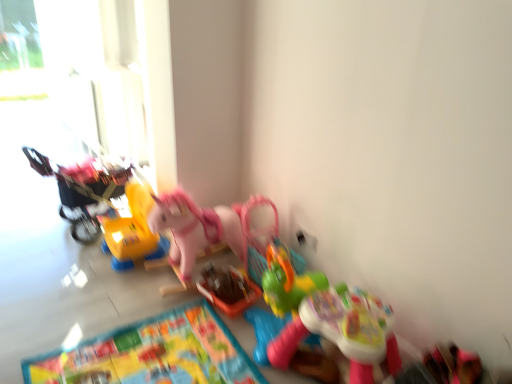
Question: Is multicolored fabric mat at lower center in front of yellow plastic toy at center-left, which is the 2th toy from left to right?

Choices:
 (A) no
 (B) yes

Answer: (B)

Question: Are multicolored fabric mat at lower center and yellow plastic toy at center-left, which ranks as the 5th toy in right-to-left order, making contact?

Choices:
 (A) no
 (B) yes

Answer: (A)

Question: From the image's perspective, would you say multicolored fabric mat at lower center is shown under yellow plastic toy at center-left, which is the 2th toy from left to right?

Choices:
 (A) yes
 (B) no

Answer: (A)

Question: Is multicolored fabric mat at lower center wider than yellow plastic toy at center-left, which ranks as the 5th toy in right-to-left order?

Choices:
 (A) no
 (B) yes

Answer: (B)

Question: Does multicolored fabric mat at lower center have a greater height compared to yellow plastic toy at center-left, which ranks as the 5th toy in right-to-left order?

Choices:
 (A) no
 (B) yes

Answer: (A)

Question: Could yellow plastic toy at center-left, which is the 2th toy from left to right, be considered to be inside multicolored fabric mat at lower center?

Choices:
 (A) yes
 (B) no

Answer: (B)

Question: Does pink plastic rocking horse at center, the 3th toy when ordered from left to right, come in front of pink plastic rocking horse at center, the third toy in the right-to-left sequence?

Choices:
 (A) no
 (B) yes

Answer: (B)

Question: From the image's perspective, is pink plastic rocking horse at center, positioned as the fourth toy in right-to-left order, beneath pink plastic rocking horse at center, the third toy in the right-to-left sequence?

Choices:
 (A) no
 (B) yes

Answer: (B)

Question: Is pink plastic rocking horse at center, the 3th toy when ordered from left to right, outside pink plastic rocking horse at center, the 4th toy in the left-to-right sequence?

Choices:
 (A) yes
 (B) no

Answer: (A)

Question: Does pink plastic rocking horse at center, positioned as the fourth toy in right-to-left order, have a larger size compared to pink plastic rocking horse at center, the third toy in the right-to-left sequence?

Choices:
 (A) yes
 (B) no

Answer: (B)

Question: Considering the relative sizes of pink plastic rocking horse at center, the 3th toy when ordered from left to right, and pink plastic rocking horse at center, the third toy in the right-to-left sequence, in the image provided, is pink plastic rocking horse at center, the 3th toy when ordered from left to right, wider than pink plastic rocking horse at center, the third toy in the right-to-left sequence,?

Choices:
 (A) yes
 (B) no

Answer: (A)

Question: Does pink plastic rocking horse at center, the 3th toy when ordered from left to right, have a smaller size compared to pink plastic rocking horse at center, the third toy in the right-to-left sequence?

Choices:
 (A) yes
 (B) no

Answer: (A)

Question: Can we say multicolored fabric mat at lower center lies outside plastic basket at center, the 2th toy positioned from the right?

Choices:
 (A) yes
 (B) no

Answer: (A)